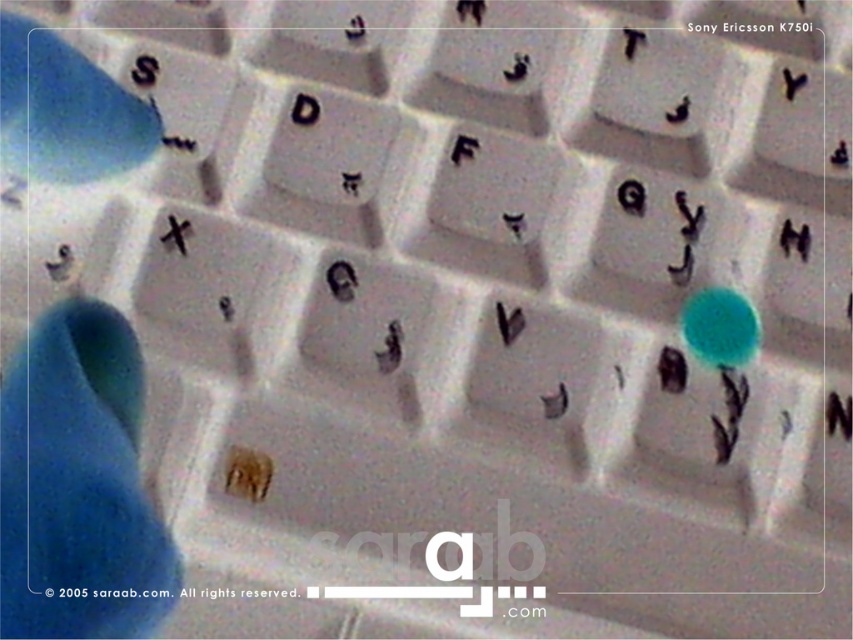
You are taking a photo of the keyboard and notice two points marked on the screen. The first point is at coordinates point (32, 385) and the second point is at coordinates point (19, 144). Which point is closer to the camera?

Point (32, 385) is in front of point (19, 144), so it is closer to the camera.

From the picture: You are a quality inspector checking the placement of items in a photo. The scene shows a white keyboard from a Sony Ericsson K750i mobile phone with some wear and dirt on the keys. You notice the blue rubber glove at lower left and the blue rubber hand at upper left. Which of these two objects is bigger in size?

The blue rubber glove at lower left is larger in size than the blue rubber hand at upper left according to the description.